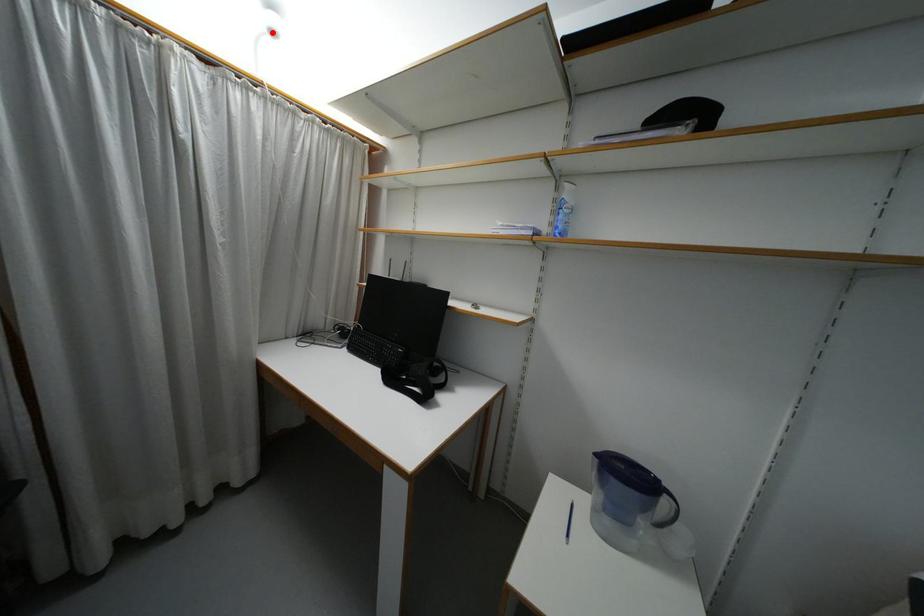
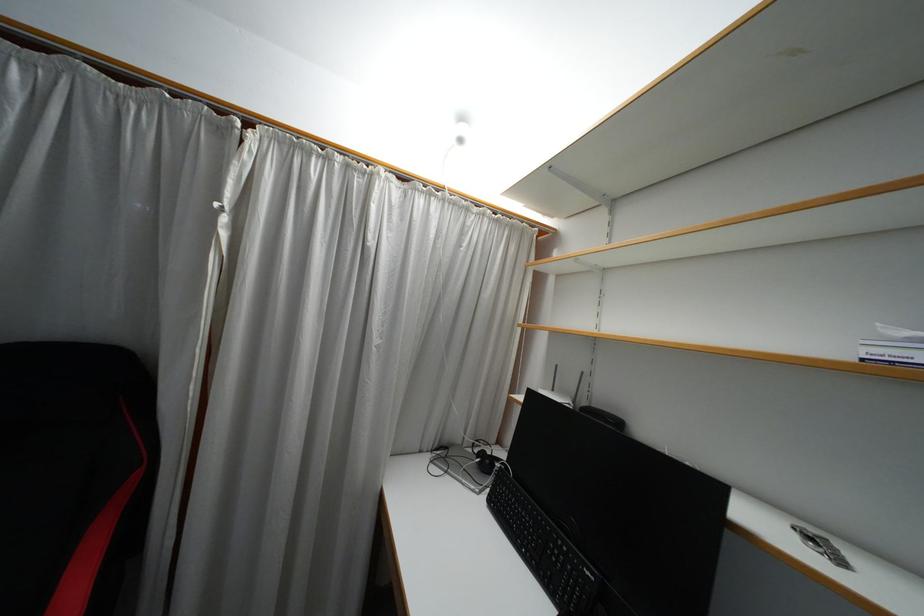
Locate, in the second image, the point that corresponds to the highlighted location in the first image.

(459, 140)